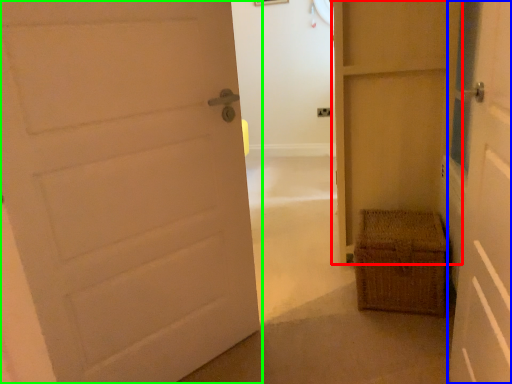
Question: Based on their relative distances, which object is nearer to door (highlighted by a red box)? Choose from door (highlighted by a blue box) and door (highlighted by a green box).

Choices:
 (A) door
 (B) door

Answer: (A)